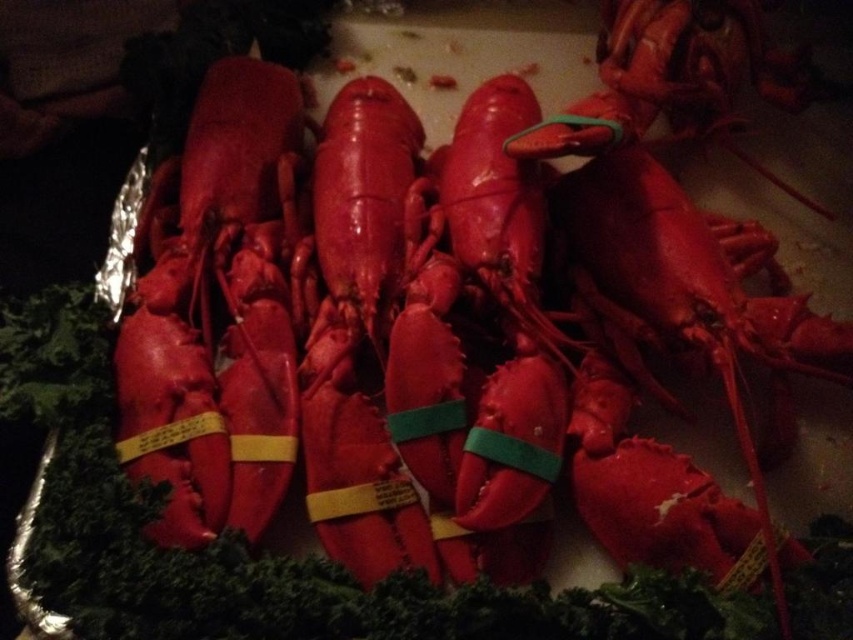
You are a chef arranging lobsters on a tray. You notice the shiny red lobster at left and the glossy red lobster at center. Which lobster is closer to the front of the tray?

The shiny red lobster at left is closer to the front of the tray because the glossy red lobster at center is positioned behind it.

You are a food stylist arranging lobsters on a tray. You need to place a decorative plate between the shiny red lobster at left and the glossy red lobster at center. Where should you place the plate?

The shiny red lobster at left is to the left of the glossy red lobster at center, so you should place the decorative plate between them to the right of the shiny red lobster at left and to the left of the glossy red lobster at center.

You are a photographer trying to capture the best angle of the cooked lobsters. You notice two points of interest marked as point [187,230] and point [373,236]. Which point is closer to your camera lens?

Point [187,230] is closer to the camera lens than point [373,236] because it is further to the camera.